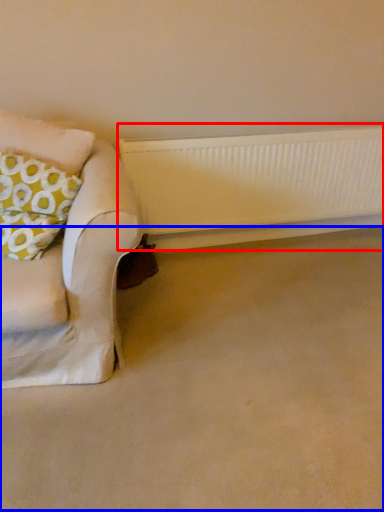
Question: Which of the following is the farthest to the observer, radiator (highlighted by a red box) or plain (highlighted by a blue box)?

Choices:
 (A) radiator
 (B) plain

Answer: (A)